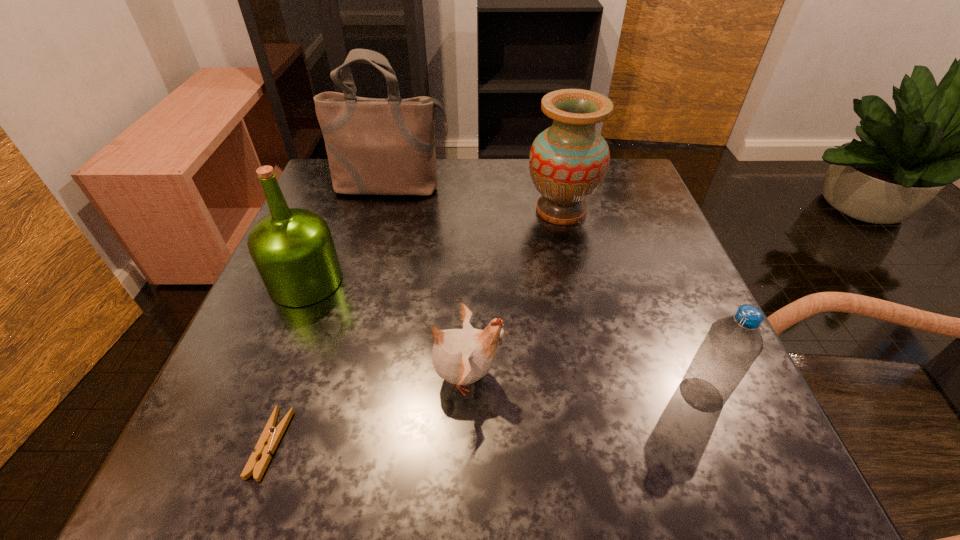
The width and height of the screenshot is (960, 540). Find the location of `free space located 0.050m on the front of the water bottle`. free space located 0.050m on the front of the water bottle is located at coordinates (722, 447).

Identify the location of vacant area situated 0.060m at the beak of the second shortest object. (542, 377).

Identify the location of vacant position located on the back of the clothespin. (330, 276).

Identify the location of shoulder bag that is at the far edge. This screenshot has height=540, width=960. (374, 146).

At what (x,y) coordinates should I click in order to perform the action: click on vase present at the far edge. Please return your answer as a coordinate pair (x, y). The image size is (960, 540). Looking at the image, I should click on (568, 162).

Locate an element on the screen. The height and width of the screenshot is (540, 960). bird present at the near edge is located at coordinates (463, 356).

The height and width of the screenshot is (540, 960). In order to click on clothespin present at the near edge in this screenshot , I will do `click(271, 435)`.

Where is `shoulder bag present at the left edge`? This screenshot has width=960, height=540. shoulder bag present at the left edge is located at coordinates (374, 146).

The image size is (960, 540). What are the coordinates of `olive oil present at the left edge` in the screenshot? It's located at (292, 248).

The width and height of the screenshot is (960, 540). Find the location of `clothespin located in the left edge section of the desktop`. clothespin located in the left edge section of the desktop is located at coordinates (271, 435).